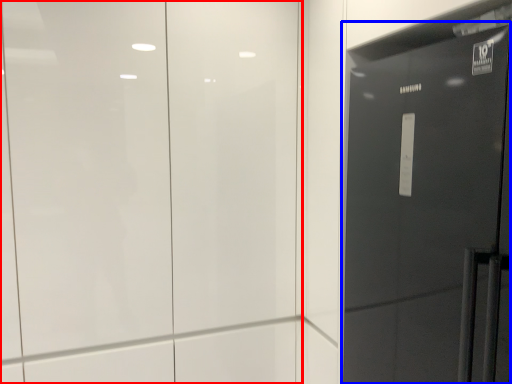
Question: Which object appears closest to the camera in this image, door (highlighted by a red box) or door (highlighted by a blue box)?

Choices:
 (A) door
 (B) door

Answer: (B)